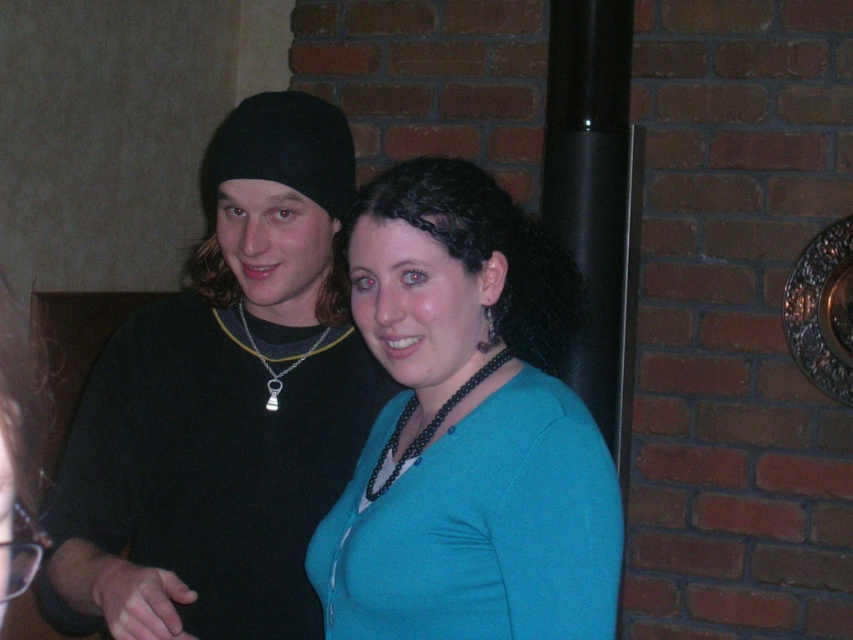
You are an interior designer assessing the placement of two items in a room. You see the teal matte cardigan at center and the silver metallic chain at center. Which item is taller?

The teal matte cardigan at center is taller than the silver metallic chain at center.

You are a fashion designer observing the two items in the image. The teal matte cardigan at center and the black beaded necklace at center. Which item is located to the right of the other?

The teal matte cardigan at center is positioned on the right side of the black beaded necklace at center.

You are a fashion designer observing two items in the image. You need to determine which item is taller between the teal matte cardigan at center and the black beaded necklace at center. Based on their positions, can you tell which one is taller?

The teal matte cardigan at center is taller than the black beaded necklace at center according to the description.